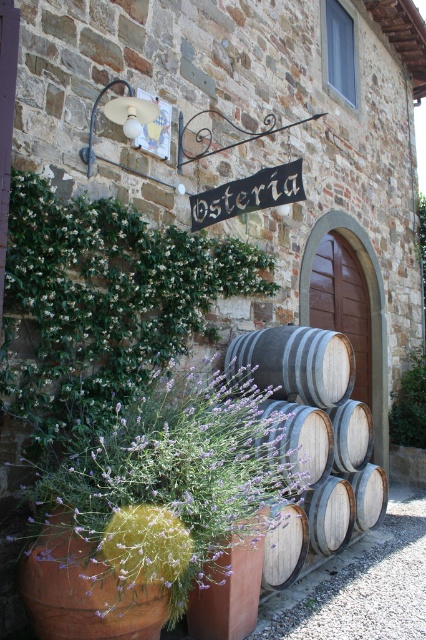
Question: Based on their relative distances, which object is farther from the purple soft-textured plant at lower left?

Choices:
 (A) gray wooden barrel at center
 (B) green leafy plant at right

Answer: (B)

Question: Does gray wooden barrel at center have a larger size compared to green leafy plant at right?

Choices:
 (A) yes
 (B) no

Answer: (A)

Question: Which of these objects is positioned farthest from the green leafy plant at right?

Choices:
 (A) purple soft-textured plant at lower left
 (B) gray wooden barrel at center

Answer: (A)

Question: Which point is closer to the camera taking this photo?

Choices:
 (A) (356, 419)
 (B) (157, 636)

Answer: (B)

Question: Can you confirm if purple soft-textured plant at lower left is positioned to the right of gray wooden barrel at center?

Choices:
 (A) yes
 (B) no

Answer: (B)

Question: Does purple soft-textured plant at lower left have a greater width compared to green leafy plant at right?

Choices:
 (A) yes
 (B) no

Answer: (A)